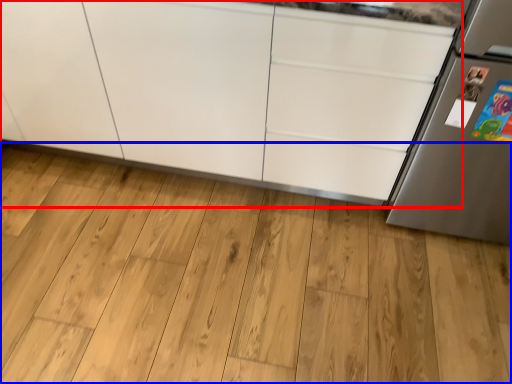
Question: Which point is further to the camera, cabinetry (highlighted by a red box) or hardwood (highlighted by a blue box)?

Choices:
 (A) cabinetry
 (B) hardwood

Answer: (B)